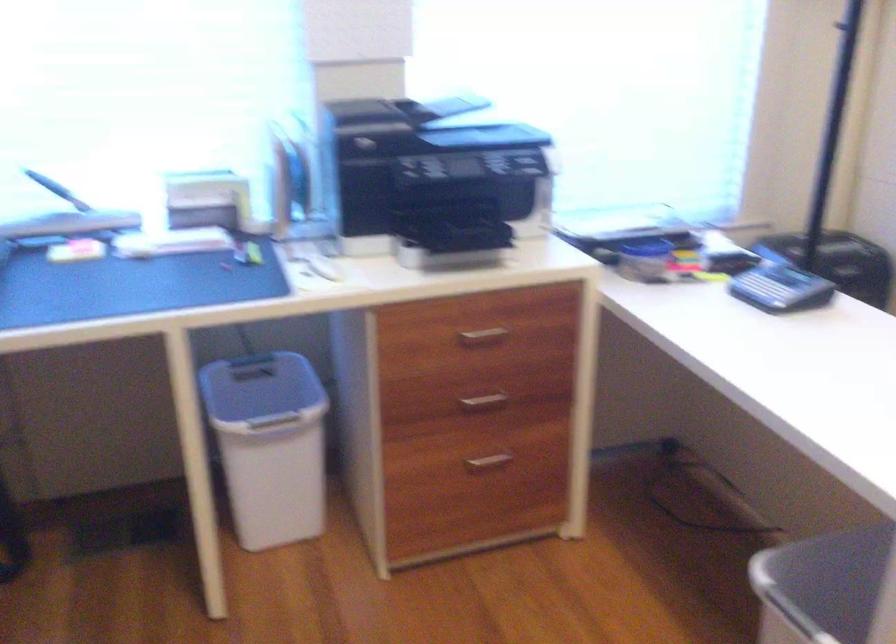
This screenshot has width=896, height=644. Find the location of `printer scanner lid`. printer scanner lid is located at coordinates (451, 106).